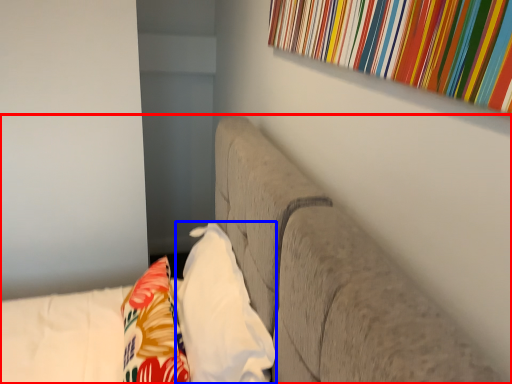
Question: Among these objects, which one is farthest to the camera, furniture (highlighted by a red box) or pillow (highlighted by a blue box)?

Choices:
 (A) furniture
 (B) pillow

Answer: (B)